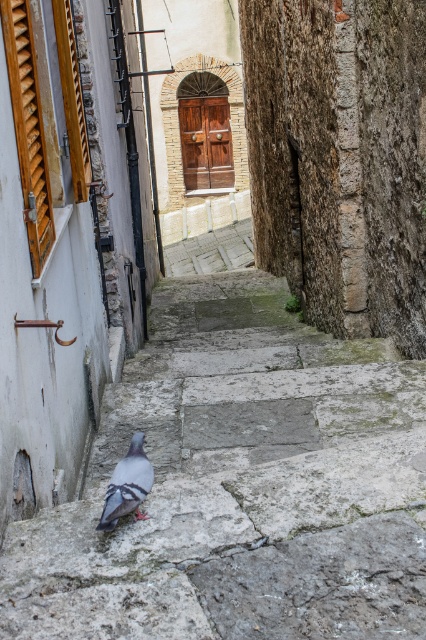
Question: Can you confirm if gray stone stairs at center is positioned to the left of gray matte pigeon at lower center?

Choices:
 (A) yes
 (B) no

Answer: (B)

Question: Which point appears farthest from the camera in this image?

Choices:
 (A) tap(101, 516)
 (B) tap(293, 572)

Answer: (A)

Question: Is gray stone stairs at center positioned behind gray matte pigeon at lower center?

Choices:
 (A) no
 (B) yes

Answer: (B)

Question: Is gray stone stairs at center thinner than gray matte pigeon at lower center?

Choices:
 (A) yes
 (B) no

Answer: (B)

Question: Among these objects, which one is farthest from the camera?

Choices:
 (A) gray stone stairs at center
 (B) gray matte pigeon at lower center

Answer: (A)

Question: Which object appears closest to the camera in this image?

Choices:
 (A) gray stone stairs at center
 (B) gray matte pigeon at lower center

Answer: (B)